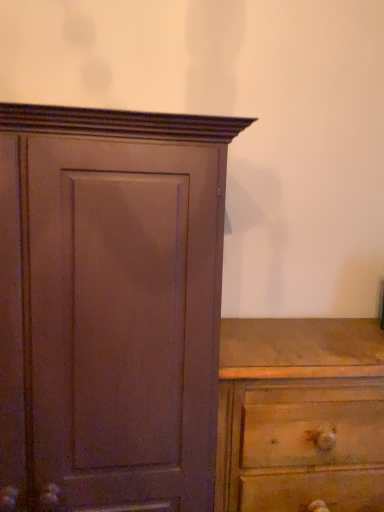
In order to face matte brown cupboard at left, should I rotate leftwards or rightwards?

A 12.903 degree turn to the left will do.

The image size is (384, 512). What do you see at coordinates (110, 306) in the screenshot? I see `matte brown cupboard at left` at bounding box center [110, 306].

This screenshot has height=512, width=384. In order to click on matte brown cupboard at left in this screenshot , I will do `click(110, 306)`.

Locate an element on the screen. Image resolution: width=384 pixels, height=512 pixels. wooden chest of drawers at lower right is located at coordinates (299, 414).

The width and height of the screenshot is (384, 512). What do you see at coordinates (299, 414) in the screenshot?
I see `wooden chest of drawers at lower right` at bounding box center [299, 414].

This screenshot has width=384, height=512. Find the location of `matte brown cupboard at left`. matte brown cupboard at left is located at coordinates (110, 306).

Which is more to the right, wooden chest of drawers at lower right or matte brown cupboard at left?

wooden chest of drawers at lower right.

Based on the photo, between wooden chest of drawers at lower right and matte brown cupboard at left, which one is positioned behind?

wooden chest of drawers at lower right is further away from the camera.

Between point (355, 409) and point (93, 323), which one is positioned behind?

The point (355, 409) is farther from the camera.

From the image's perspective, is wooden chest of drawers at lower right located above matte brown cupboard at left?

No, from the image's perspective, wooden chest of drawers at lower right is not above matte brown cupboard at left.

From a real-world perspective, which is physically below, wooden chest of drawers at lower right or matte brown cupboard at left?

wooden chest of drawers at lower right, from a real-world perspective.

Which of these two, wooden chest of drawers at lower right or matte brown cupboard at left, is wider?

matte brown cupboard at left.

Considering the sizes of wooden chest of drawers at lower right and matte brown cupboard at left in the image, is wooden chest of drawers at lower right taller or shorter than matte brown cupboard at left?

In the image, wooden chest of drawers at lower right appears to be shorter than matte brown cupboard at left.

Based on the photo, considering the sizes of objects wooden chest of drawers at lower right and matte brown cupboard at left in the image provided, who is bigger, wooden chest of drawers at lower right or matte brown cupboard at left?

matte brown cupboard at left is bigger.

Which is correct: wooden chest of drawers at lower right is inside matte brown cupboard at left, or outside of it?

The correct answer is: outside.

Are wooden chest of drawers at lower right and matte brown cupboard at left located far from each other?

No, wooden chest of drawers at lower right is not far from matte brown cupboard at left.

Is matte brown cupboard at left at the back of wooden chest of drawers at lower right?

That's not correct — wooden chest of drawers at lower right is not looking away from matte brown cupboard at left.

From the picture: Can you tell me how much wooden chest of drawers at lower right and matte brown cupboard at left differ in facing direction?

The angular difference between wooden chest of drawers at lower right and matte brown cupboard at left is 0.676 degrees.

How distant is wooden chest of drawers at lower right from matte brown cupboard at left?

A distance of 12.85 inches exists between wooden chest of drawers at lower right and matte brown cupboard at left.

The image size is (384, 512). What are the coordinates of `chest of drawers below the matte brown cupboard at left (from the image's perspective)` in the screenshot? It's located at (299, 414).

Which is more to the left, matte brown cupboard at left or wooden chest of drawers at lower right?

matte brown cupboard at left is more to the left.

Is matte brown cupboard at left positioned before wooden chest of drawers at lower right?

That is True.

Between point (0, 164) and point (287, 493), which one is positioned behind?

The point (287, 493) is more distant.

From the image's perspective, between matte brown cupboard at left and wooden chest of drawers at lower right, who is located below?

wooden chest of drawers at lower right.

From a real-world perspective, is matte brown cupboard at left over wooden chest of drawers at lower right?

Yes, from a real-world perspective, matte brown cupboard at left is above wooden chest of drawers at lower right.

Can you confirm if matte brown cupboard at left is thinner than wooden chest of drawers at lower right?

No.

Considering the relative sizes of matte brown cupboard at left and wooden chest of drawers at lower right in the image provided, is matte brown cupboard at left taller than wooden chest of drawers at lower right?

Indeed, matte brown cupboard at left has a greater height compared to wooden chest of drawers at lower right.

Can you confirm if matte brown cupboard at left is smaller than wooden chest of drawers at lower right?

Incorrect, matte brown cupboard at left is not smaller in size than wooden chest of drawers at lower right.

Is wooden chest of drawers at lower right surrounded by matte brown cupboard at left?

No, wooden chest of drawers at lower right is not surrounded by matte brown cupboard at left.

Based on the photo, is matte brown cupboard at left touching wooden chest of drawers at lower right?

No, matte brown cupboard at left is not in contact with wooden chest of drawers at lower right.

Is matte brown cupboard at left oriented towards wooden chest of drawers at lower right?

No, matte brown cupboard at left does not turn towards wooden chest of drawers at lower right.

What's the angular difference between matte brown cupboard at left and wooden chest of drawers at lower right's facing directions?

0.676 degrees.

This screenshot has width=384, height=512. I want to click on the chest of drawers that appears below the matte brown cupboard at left (from the image's perspective), so click(299, 414).

Find the location of a particular element. cupboard in front of the wooden chest of drawers at lower right is located at coordinates (110, 306).

What are the coordinates of `chest of drawers below the matte brown cupboard at left (from a real-world perspective)` in the screenshot? It's located at (299, 414).